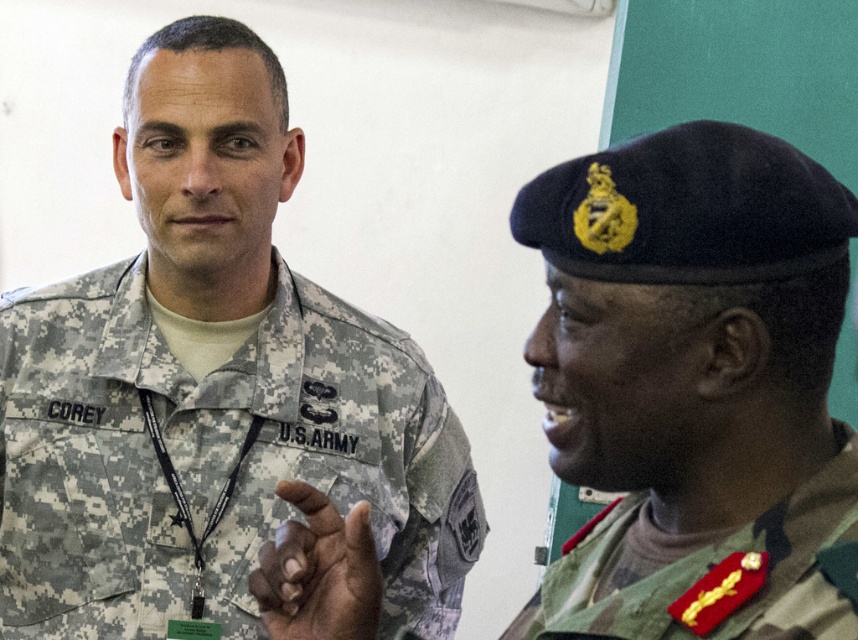
You are a photographer standing 2 meters behind the two people in the scene. You want to take a photo that includes both the camouflage fabric us army uniform at left and the person on the right. Will both subjects fit in the frame if your camera has a 1.5 meter field of view?

The two people are 1.36 meters apart, so yes, both the camouflage fabric us army uniform at left and the person on the right will fit in the frame since the distance between them is less than the camera field of view of 1.5 meters.

You are a photographer taking a picture of two people in camouflage uniforms. The camouflage fabric us army uniform at left and the green camouflage uniform at right are both in your shot. Which uniform is closer to the camera?

The camouflage fabric us army uniform at left is closer to the camera because it is positioned over the green camouflage uniform at right.